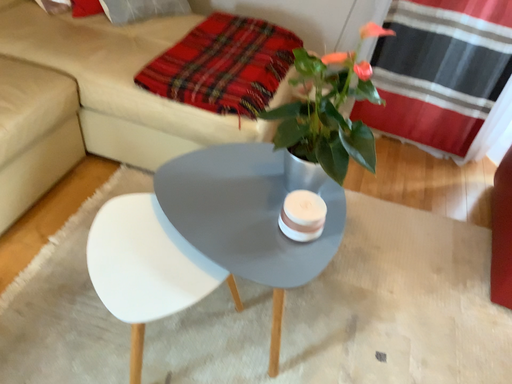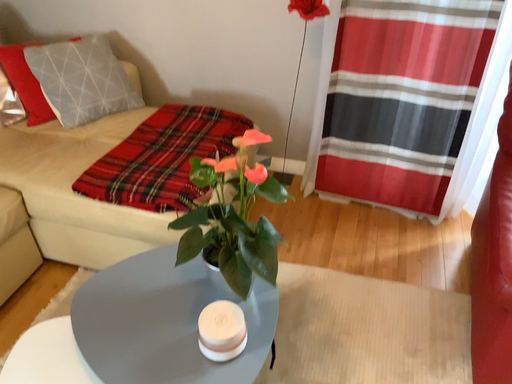
Question: How did the camera likely rotate when shooting the video?

Choices:
 (A) rotated downward
 (B) rotated upward

Answer: (B)